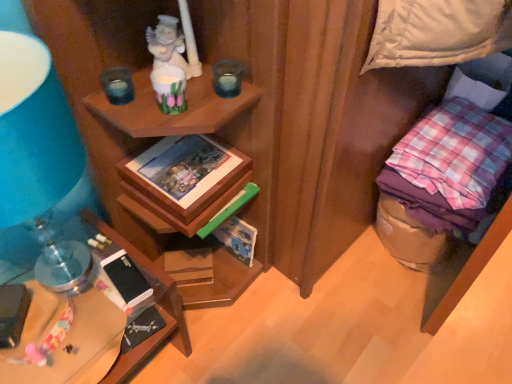
Question: From the image's perspective, is brown cardboard magazine at lower center located above or below pink checkered fabric at right?

Choices:
 (A) above
 (B) below

Answer: (B)

Question: From a real-world perspective, is brown cardboard magazine at lower center positioned above or below pink checkered fabric at right?

Choices:
 (A) below
 (B) above

Answer: (A)

Question: Estimate the real-world distances between objects in this image. Which object is farther from the porcelain statue at upper center?

Choices:
 (A) white glossy cup at upper center, the 2th candle holder in the right-to-left sequence
 (B) pink checkered fabric at right
 (C) wooden picture frame at center
 (D) black matte mobile phone at lower left, which is counted as the second mobile phone, starting from the right
 (E) brown cardboard magazine at lower center

Answer: (B)

Question: Considering the real-world distances, which object is farthest from the brown cardboard magazine at lower center?

Choices:
 (A) translucent glass candle at upper center, marked as the 3th candle holder in a right-to-left arrangement
 (B) wooden desk at lower left
 (C) wooden picture frame at center
 (D) pink checkered fabric at right
 (E) transparent glass candle at upper center, the first candle holder in the right-to-left sequence

Answer: (D)